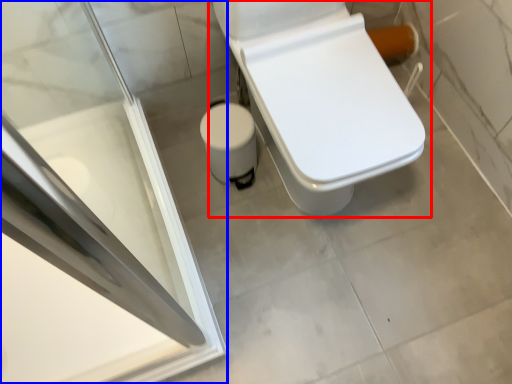
Question: Which object appears farthest to the camera in this image, toilet (highlighted by a red box) or screen door (highlighted by a blue box)?

Choices:
 (A) toilet
 (B) screen door

Answer: (A)